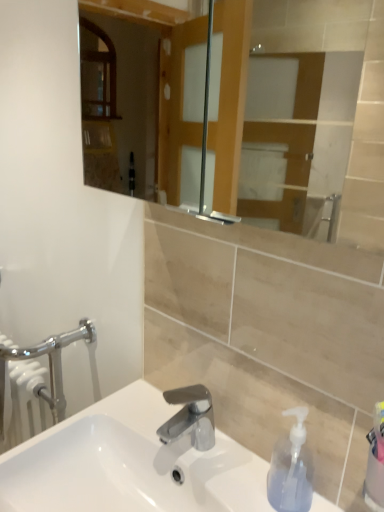
This screenshot has width=384, height=512. Find the location of `vacant space to the right of chrome metallic faucet at center`. vacant space to the right of chrome metallic faucet at center is located at coordinates (233, 468).